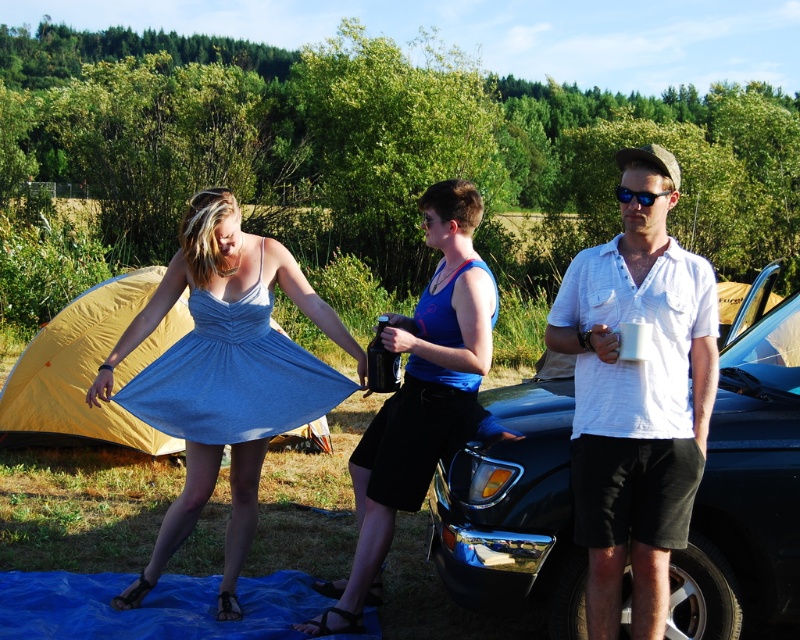
Looking at this image, you are standing at the point with coordinates (636,396) in the campsite image. What object is located exactly at this point?

The point at coordinates (636,396) corresponds to the white cotton shirt at center.

You are planning to pack a bag for a day trip and need to decide between the matte blue dress at center and the blue tarp at lower center. Based on their sizes, which item would take up less space in your bag?

The matte blue dress at center has a lesser width compared to the blue tarp at lower center, so it would take up less space in your bag.

You are a photographer at the campsite and want to take a photo of the white cotton shirt at center and the blue satin dress at center. Which one is closer to the camera?

The white cotton shirt at center is in front of the blue satin dress at center, so it is closer to the camera.